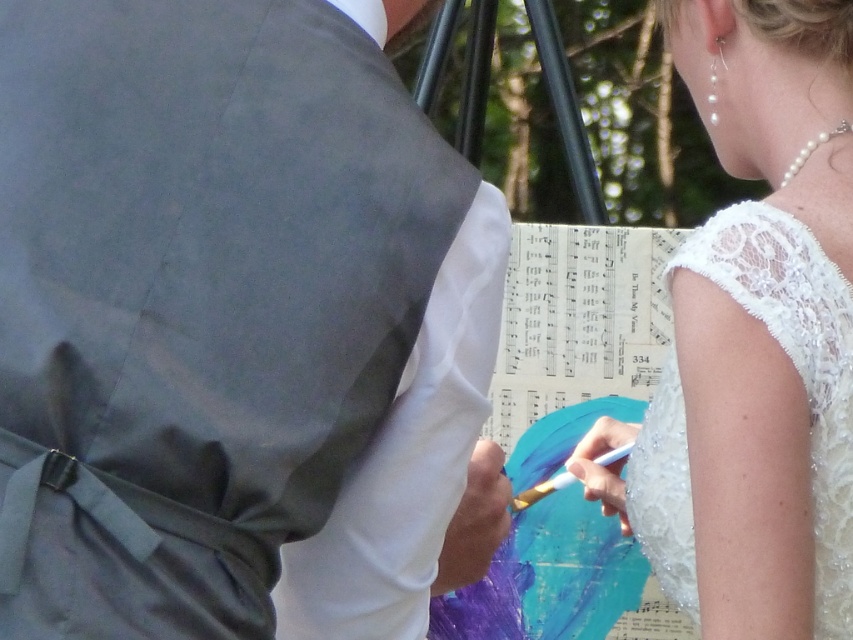
Question: Can you confirm if matte gray vest at center is smaller than white lace dress at upper right?

Choices:
 (A) yes
 (B) no

Answer: (B)

Question: In this image, where is matte gray vest at center located relative to white lace dress at upper right?

Choices:
 (A) below
 (B) above

Answer: (B)

Question: Which of the following is the closest to the observer?

Choices:
 (A) (155, 346)
 (B) (751, 225)

Answer: (A)

Question: Does matte gray vest at center have a lesser width compared to white lace dress at upper right?

Choices:
 (A) yes
 (B) no

Answer: (B)

Question: Which point appears closest to the camera in this image?

Choices:
 (A) (833, 461)
 (B) (27, 451)

Answer: (B)